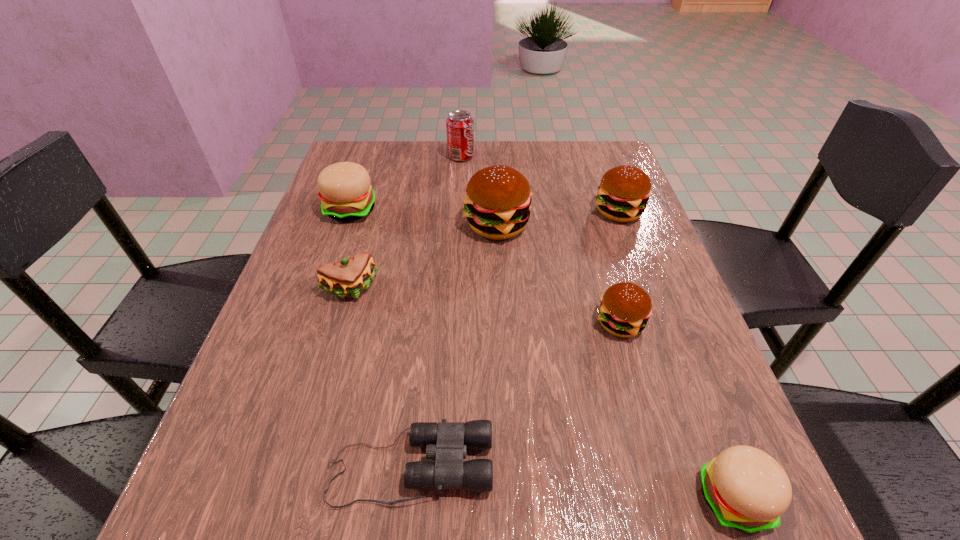
The height and width of the screenshot is (540, 960). Identify the location of vacant area that lies between the shortest object and the biggest brown hamburger. click(x=454, y=346).

This screenshot has width=960, height=540. In order to click on vacant space that's between the sandwich and the farthest object in this screenshot , I will do `click(406, 222)`.

In order to click on free spot between the farther beige hamburger and the soda can in this screenshot , I will do `click(406, 183)`.

Locate an element on the screen. vacant point located between the sandwich and the tallest hamburger is located at coordinates (423, 256).

Find the location of a particular element. The image size is (960, 540). free space between the farther beige hamburger and the smallest brown hamburger is located at coordinates (486, 266).

Locate an element on the screen. Image resolution: width=960 pixels, height=540 pixels. empty space between the leftmost hamburger and the nearest hamburger is located at coordinates (542, 354).

Locate an element on the screen. Image resolution: width=960 pixels, height=540 pixels. empty space that is in between the sandwich and the smallest brown hamburger is located at coordinates (485, 306).

Find the location of a particular element. blank region between the fourth farthest hamburger and the binoculars is located at coordinates (516, 394).

You are a GUI agent. You are given a task and a screenshot of the screen. Output one action in this format:
    pyautogui.click(x=<x>, y=<y>)
    Task: Click on the empty space that is in between the second biggest brown hamburger and the nearer beige hamburger
    The width and height of the screenshot is (960, 540).
    Given the screenshot: What is the action you would take?
    pyautogui.click(x=676, y=354)

Identify which object is located as the sixth nearest to the nearest brown hamburger. Please provide its 2D coordinates. Your answer should be formatted as a tuple, i.e. [(x, y)], where the tuple contains the x and y coordinates of a point satisfying the conditions above.

[(345, 192)]